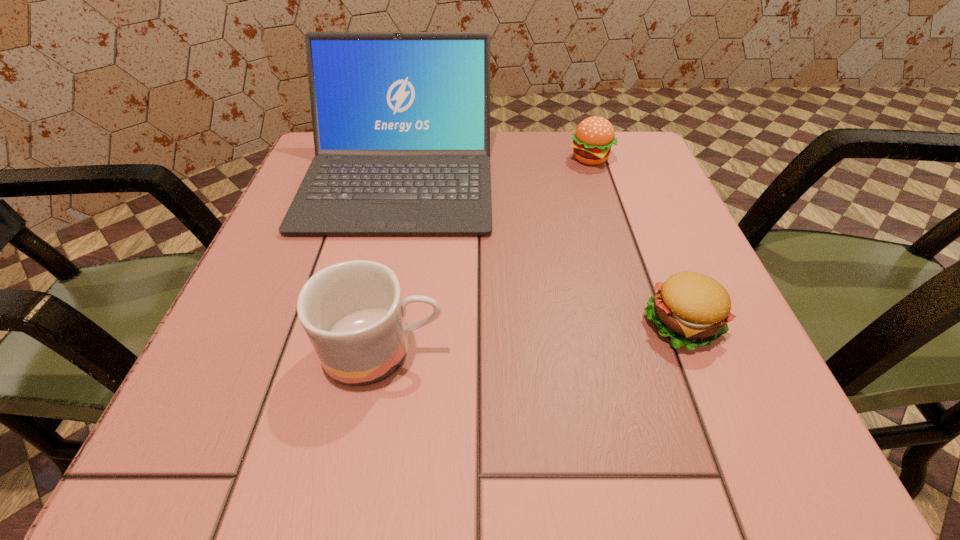
The height and width of the screenshot is (540, 960). I want to click on vacant space that is in between the farther hamburger and the third shortest object, so click(487, 254).

Where is `free area in between the tallest object and the mug`? Image resolution: width=960 pixels, height=540 pixels. free area in between the tallest object and the mug is located at coordinates click(x=392, y=264).

Where is `unoccupied position between the shorter hamburger and the farther hamburger`? unoccupied position between the shorter hamburger and the farther hamburger is located at coordinates point(636,241).

Find the location of a particular element. vacant region between the mug and the farther hamburger is located at coordinates (487, 254).

This screenshot has height=540, width=960. Identify the location of free space that is in between the farther hamburger and the second tallest object. (487, 254).

What are the coordinates of `vacant area that lies between the second tallest object and the laptop computer` in the screenshot? It's located at (392, 264).

What are the coordinates of `vacant space in between the farther hamburger and the third shortest object` in the screenshot? It's located at (487, 254).

Locate an element on the screen. blank region between the tallest object and the second tallest object is located at coordinates (392, 264).

Identify the location of vacant space in between the nearer hamburger and the farther hamburger. This screenshot has width=960, height=540. click(636, 241).

In order to click on vacant space that is in between the laptop computer and the nearer hamburger in this screenshot , I will do `click(540, 251)`.